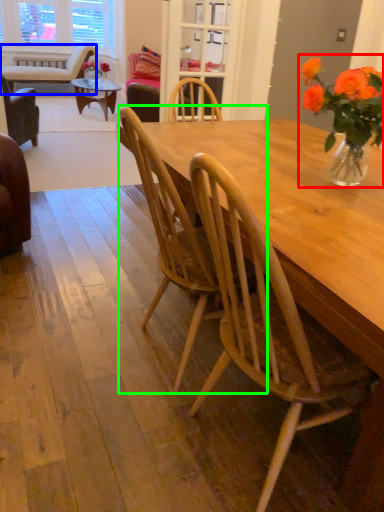
Question: Which is farther away from floral arrangement (highlighted by a red box)? chair (highlighted by a blue box) or chair (highlighted by a green box)?

Choices:
 (A) chair
 (B) chair

Answer: (A)